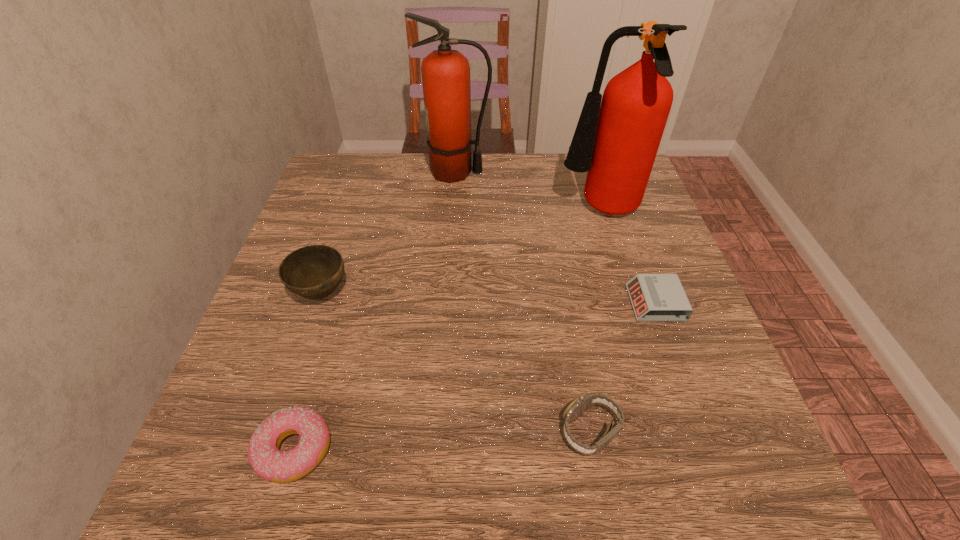
Locate an element on the screen. The image size is (960, 540). free location at the far left corner is located at coordinates (349, 187).

Where is `vacant space that's between the third object from left to right and the fifth nearest object`? The height and width of the screenshot is (540, 960). vacant space that's between the third object from left to right and the fifth nearest object is located at coordinates click(528, 192).

Locate an element on the screen. The width and height of the screenshot is (960, 540). blank region between the farther fire extinguisher and the third tallest object is located at coordinates (389, 233).

The image size is (960, 540). Identify the location of blank region between the right fire extinguisher and the bowl. (461, 253).

Find the location of a particular element. The width and height of the screenshot is (960, 540). empty space that is in between the second shortest object and the third object from left to right is located at coordinates (375, 311).

At what (x,y) coordinates should I click in order to perform the action: click on empty location between the right fire extinguisher and the alarm clock. Please return your answer as a coordinate pair (x, y). Looking at the image, I should click on (628, 257).

This screenshot has height=540, width=960. In order to click on vacant area that lies between the second shortest object and the fourth shortest object in this screenshot , I will do `click(308, 372)`.

At what (x,y) coordinates should I click in order to perform the action: click on vacant region between the third object from left to right and the watch. Please return your answer as a coordinate pair (x, y). The image size is (960, 540). Looking at the image, I should click on (523, 302).

Find the location of a particular element. free space between the right fire extinguisher and the second shortest object is located at coordinates (446, 330).

Where is `free space between the third shortest object and the alarm clock`? The height and width of the screenshot is (540, 960). free space between the third shortest object and the alarm clock is located at coordinates (623, 367).